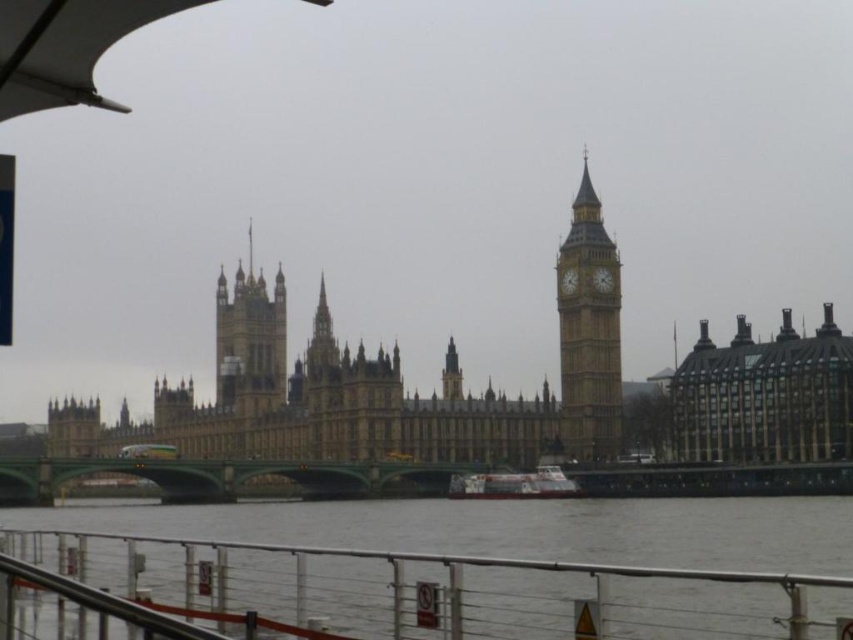
Question: Which point appears farthest from the camera in this image?

Choices:
 (A) (105, 470)
 (B) (643, 579)

Answer: (A)

Question: Does dark brown stone building at right have a lesser width compared to white plastic boat at center?

Choices:
 (A) no
 (B) yes

Answer: (A)

Question: Which point is farther to the camera?

Choices:
 (A) (802, 348)
 (B) (77, 467)
 (C) (477, 476)
 (D) (576, 284)

Answer: (B)

Question: In this image, where is dark brown stone building at right located relative to white plastic boat at center?

Choices:
 (A) below
 (B) above

Answer: (B)

Question: Can you confirm if metallic silver rail at lower center is positioned to the right of dark brown stone building at right?

Choices:
 (A) no
 (B) yes

Answer: (A)

Question: Which point is closer to the camera taking this photo?

Choices:
 (A) (650, 593)
 (B) (602, 445)
 (C) (674, 390)
 (D) (346, 484)

Answer: (A)